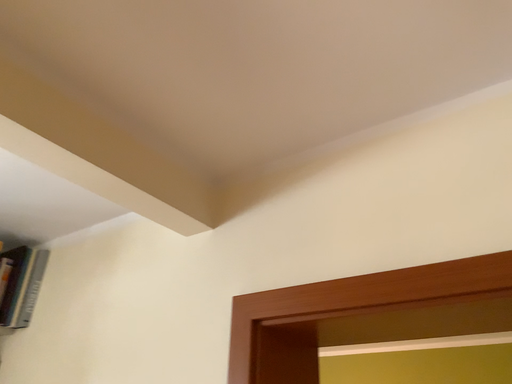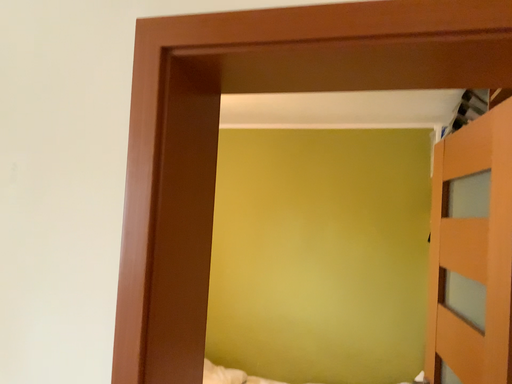
Question: How did the camera likely rotate when shooting the video?

Choices:
 (A) rotated left
 (B) rotated right

Answer: (B)